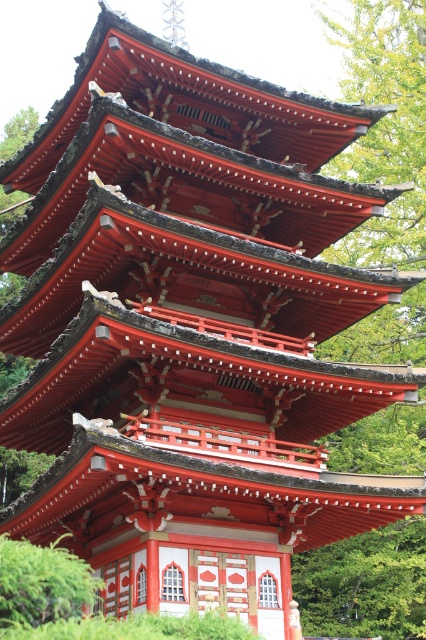
Who is more forward, (396, 211) or (74, 557)?

Point (74, 557) is in front.

Is green leafy tree at upper center positioned before green leafy bush at lower left?

No, it is not.

What do you see at coordinates (385, 125) in the screenshot? I see `green leafy tree at upper center` at bounding box center [385, 125].

This screenshot has width=426, height=640. Identify the location of green leafy tree at upper center. (385, 125).